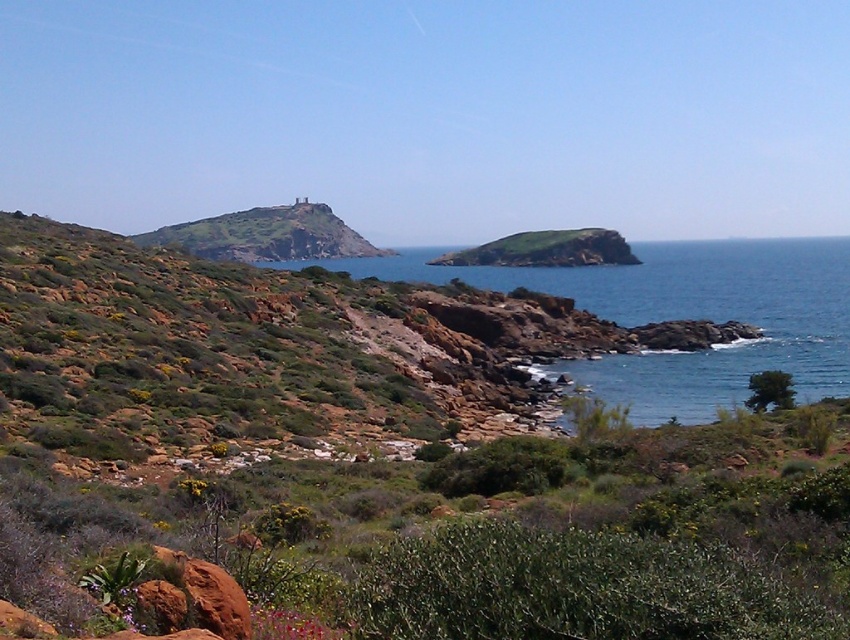
Is blue water at center smaller than green grassy hillside at left?

Incorrect, blue water at center is not smaller in size than green grassy hillside at left.

Between point (491, 280) and point (159, 237), which one is positioned behind?

Point (159, 237)

Between point (694, 268) and point (323, 209), which one is positioned in front?

Positioned in front is point (694, 268).

Where is `blue water at center`? The image size is (850, 640). blue water at center is located at coordinates (683, 316).

Is green shrubbery at center smaller than green grassy hillside at left?

Yes.

Locate an element on the screen. The height and width of the screenshot is (640, 850). green shrubbery at center is located at coordinates (474, 541).

Does green shrubbery at center appear on the left side of blue water at center?

Indeed, green shrubbery at center is positioned on the left side of blue water at center.

Does green shrubbery at center appear on the right side of blue water at center?

In fact, green shrubbery at center is to the left of blue water at center.

Which is in front, point (394, 586) or point (794, 276)?

Positioned in front is point (394, 586).

Where is `green shrubbery at center`? The width and height of the screenshot is (850, 640). green shrubbery at center is located at coordinates (474, 541).